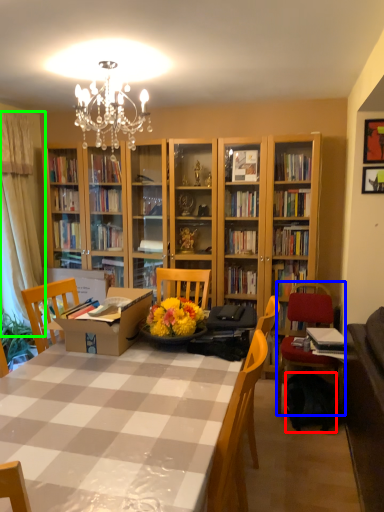
Question: Based on their relative distances, which object is farther from backpack (highlighted by a red box)? Choose from chair (highlighted by a blue box) and curtain (highlighted by a green box).

Choices:
 (A) chair
 (B) curtain

Answer: (B)